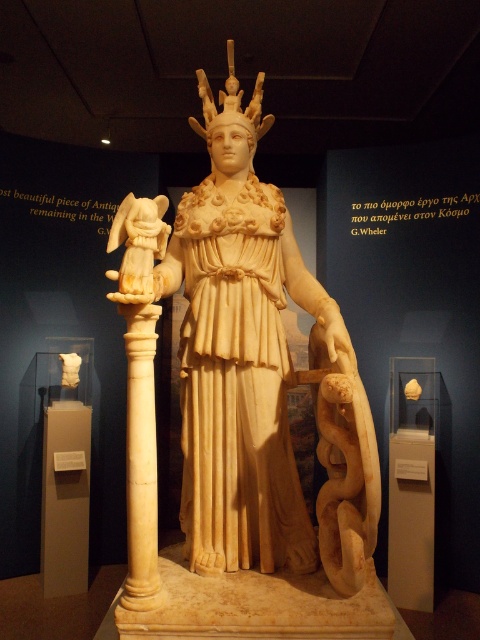
Which is below, white marble statue at center or white marble pedestal at lower left?

white marble pedestal at lower left is below.

Is white marble statue at center bigger than white marble pedestal at lower left?

Correct, white marble statue at center is larger in size than white marble pedestal at lower left.

Image resolution: width=480 pixels, height=640 pixels. I want to click on white marble statue at center, so click(257, 372).